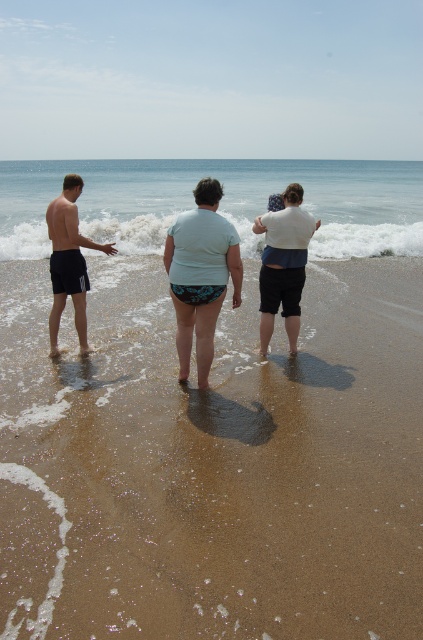
Which of these two, light blue fabric bikini bottom at center or matte black shorts at left, stands taller?

Standing taller between the two is matte black shorts at left.

Is point (219, 257) farther from camera compared to point (85, 278)?

No, it is not.

I want to click on light blue fabric bikini bottom at center, so click(x=200, y=275).

Which of these two, clear blue water at center or light blue fabric bikini bottom at center, stands taller?

With more height is clear blue water at center.

Can you confirm if clear blue water at center is thinner than light blue fabric bikini bottom at center?

No, clear blue water at center is not thinner than light blue fabric bikini bottom at center.

Is point (38, 257) less distant than point (235, 252)?

No, (38, 257) is behind (235, 252).

Where is `clear blue water at center`? The width and height of the screenshot is (423, 640). clear blue water at center is located at coordinates (220, 202).

Is clear blue water at center smaller than white cotton shirt at center?

No, clear blue water at center is not smaller than white cotton shirt at center.

Does clear blue water at center appear on the left side of white cotton shirt at center?

Correct, you'll find clear blue water at center to the left of white cotton shirt at center.

The height and width of the screenshot is (640, 423). What do you see at coordinates (220, 202) in the screenshot?
I see `clear blue water at center` at bounding box center [220, 202].

The image size is (423, 640). What are the coordinates of `clear blue water at center` in the screenshot? It's located at (220, 202).